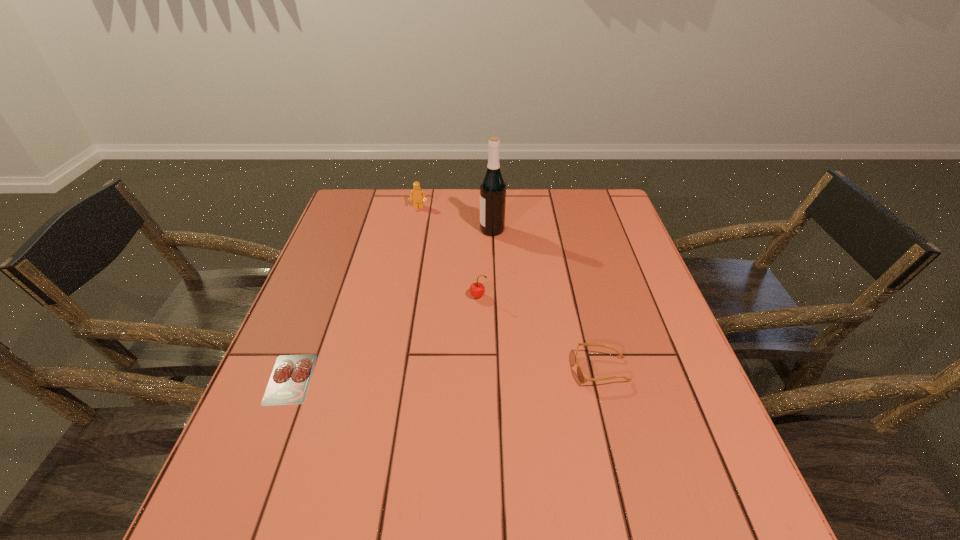
What are the coordinates of `the tallest object` in the screenshot? It's located at (493, 187).

In order to click on the second farthest object in this screenshot , I will do `click(493, 187)`.

The width and height of the screenshot is (960, 540). I want to click on Lego, so pos(417,194).

At what (x,y) coordinates should I click in order to perform the action: click on the farthest object. Please return your answer as a coordinate pair (x, y). Looking at the image, I should click on (417, 194).

Identify the location of cherry. (477, 289).

Locate an element on the screen. the fourth tallest object is located at coordinates (582, 378).

Where is `sunglasses`? The height and width of the screenshot is (540, 960). sunglasses is located at coordinates (582, 378).

Where is `salami`? The height and width of the screenshot is (540, 960). salami is located at coordinates (291, 375).

The image size is (960, 540). I want to click on the shortest object, so click(x=291, y=375).

The width and height of the screenshot is (960, 540). Identify the location of blank space located 0.400m on the label of the tallest object. (350, 230).